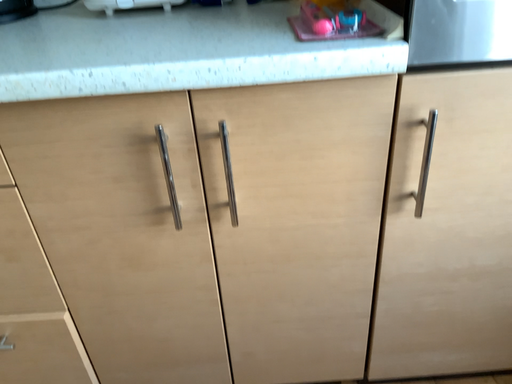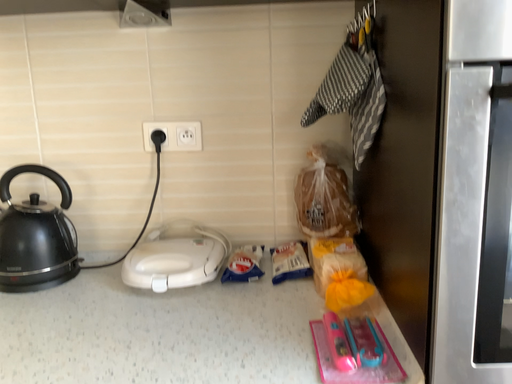
Question: How did the camera likely rotate when shooting the video?

Choices:
 (A) rotated upward
 (B) rotated downward

Answer: (A)